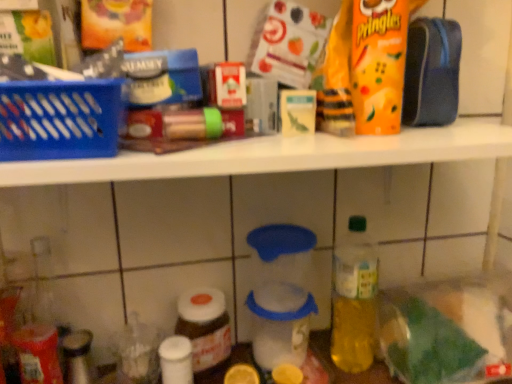
Question: From a real-world perspective, does transparent plastic container at center sit lower than yellow matte lemon at lower center, which is counted as the second lemon, starting from the left?

Choices:
 (A) no
 (B) yes

Answer: (A)

Question: Does transparent plastic container at center appear on the right side of yellow matte lemon at lower center, which is counted as the second lemon, starting from the left?

Choices:
 (A) no
 (B) yes

Answer: (A)

Question: Is transparent plastic container at center oriented towards yellow matte lemon at lower center, which is counted as the second lemon, starting from the left?

Choices:
 (A) no
 (B) yes

Answer: (B)

Question: Can you confirm if transparent plastic container at center is shorter than yellow matte lemon at lower center, which is counted as the second lemon, starting from the left?

Choices:
 (A) no
 (B) yes

Answer: (A)

Question: Is transparent plastic container at center located outside yellow matte lemon at lower center, the 1th lemon positioned from the right?

Choices:
 (A) no
 (B) yes

Answer: (B)

Question: Is transparent plastic container at center turned away from yellow matte lemon at lower center, the 1th lemon positioned from the right?

Choices:
 (A) no
 (B) yes

Answer: (A)

Question: Can you confirm if green plastic bottle at center-right, positioned as the 3th bottle in left-to-right order, is positioned to the right of transparent plastic container at center?

Choices:
 (A) yes
 (B) no

Answer: (A)

Question: Can transparent plastic container at center be found inside green plastic bottle at center-right, which appears as the 1th bottle when viewed from the right?

Choices:
 (A) no
 (B) yes

Answer: (A)

Question: Is there a large distance between green plastic bottle at center-right, positioned as the 3th bottle in left-to-right order, and transparent plastic container at center?

Choices:
 (A) yes
 (B) no

Answer: (B)

Question: Does green plastic bottle at center-right, positioned as the 3th bottle in left-to-right order, touch transparent plastic container at center?

Choices:
 (A) no
 (B) yes

Answer: (A)

Question: Could you tell me if green plastic bottle at center-right, which appears as the 1th bottle when viewed from the right, is facing transparent plastic container at center?

Choices:
 (A) no
 (B) yes

Answer: (A)

Question: From the image's perspective, is green plastic bottle at center-right, which appears as the 1th bottle when viewed from the right, above transparent plastic container at center?

Choices:
 (A) no
 (B) yes

Answer: (B)

Question: Is yellow matte lemon at lower center, which is counted as the second lemon, starting from the left, directly adjacent to orange matte pringles at upper right?

Choices:
 (A) no
 (B) yes

Answer: (A)